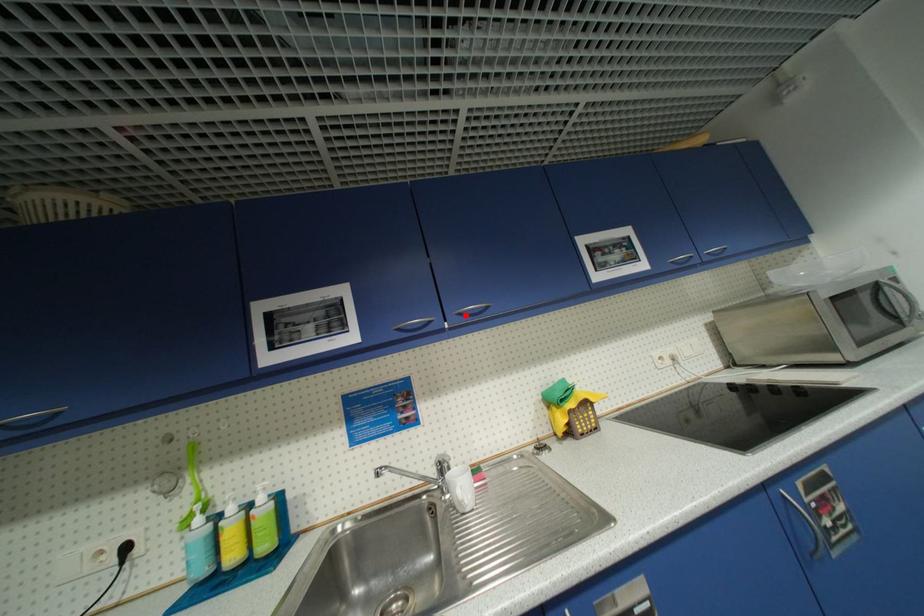
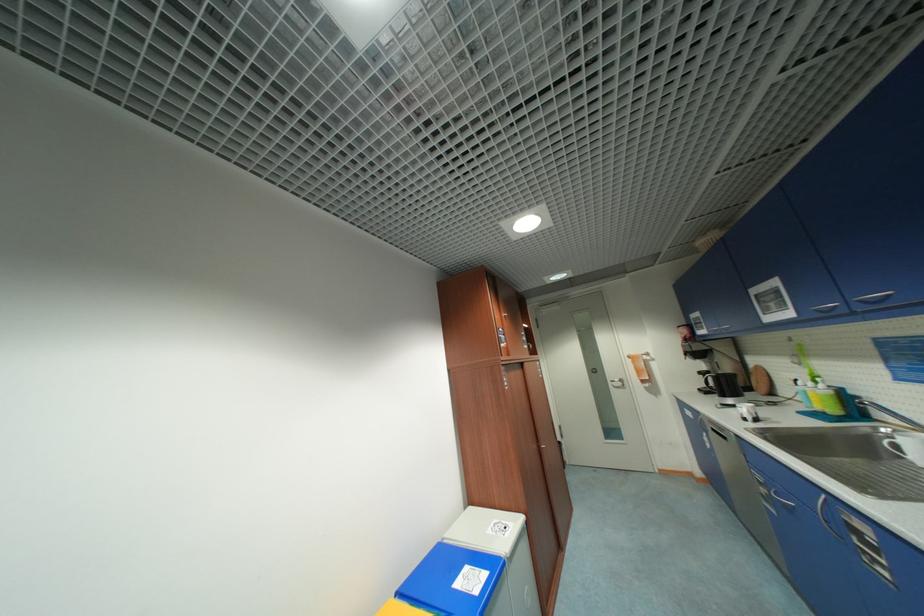
In the second image, find the point that corresponds to the highlighted location in the first image.

(867, 302)